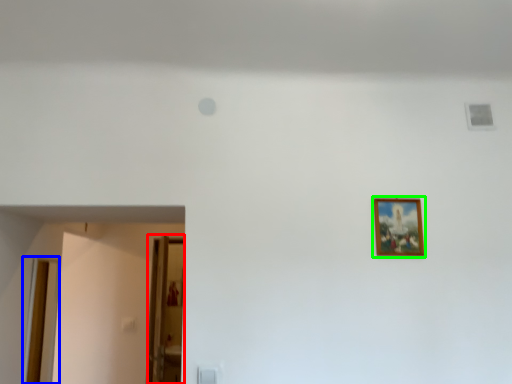
Question: Estimate the real-world distances between objects in this image. Which object is farther from glass door (highlighted by a red box), door (highlighted by a blue box) or picture frame (highlighted by a green box)?

Choices:
 (A) door
 (B) picture frame

Answer: (B)